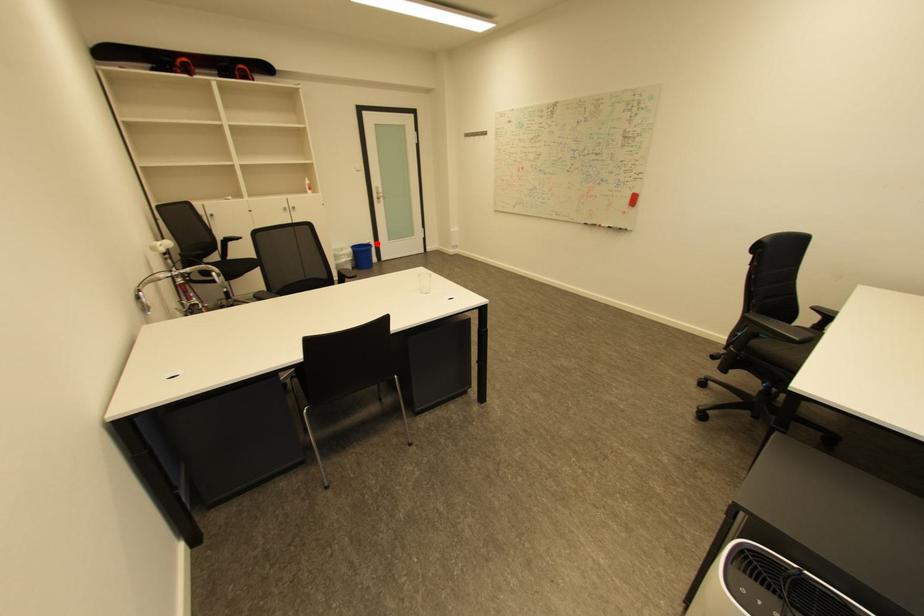
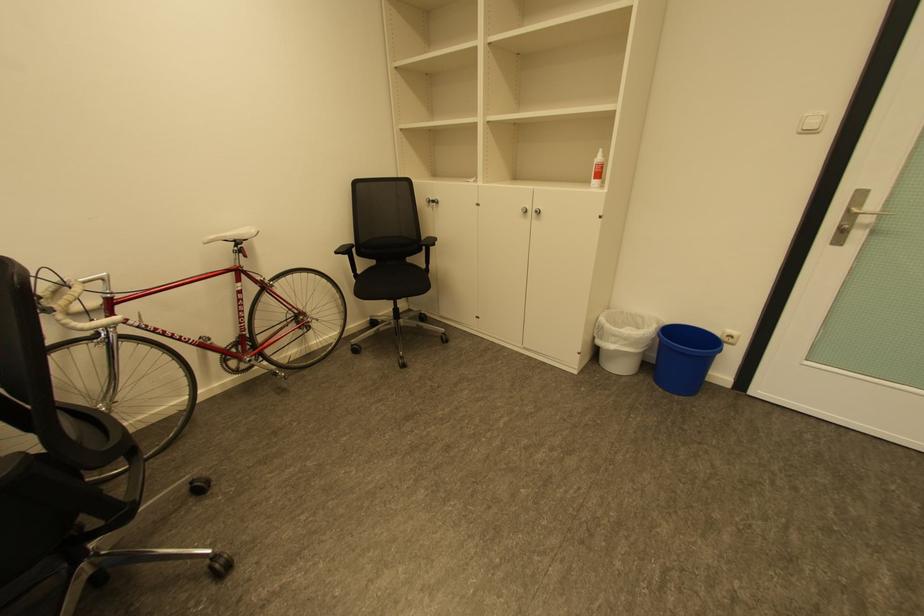
Question: I am providing you with two images of the same scene from different viewpoints. In image1, a red point is highlighted. Considering the same 3D point in image2, which of the following is correct?

Choices:
 (A) It is closer
 (B) It is farther

Answer: (B)